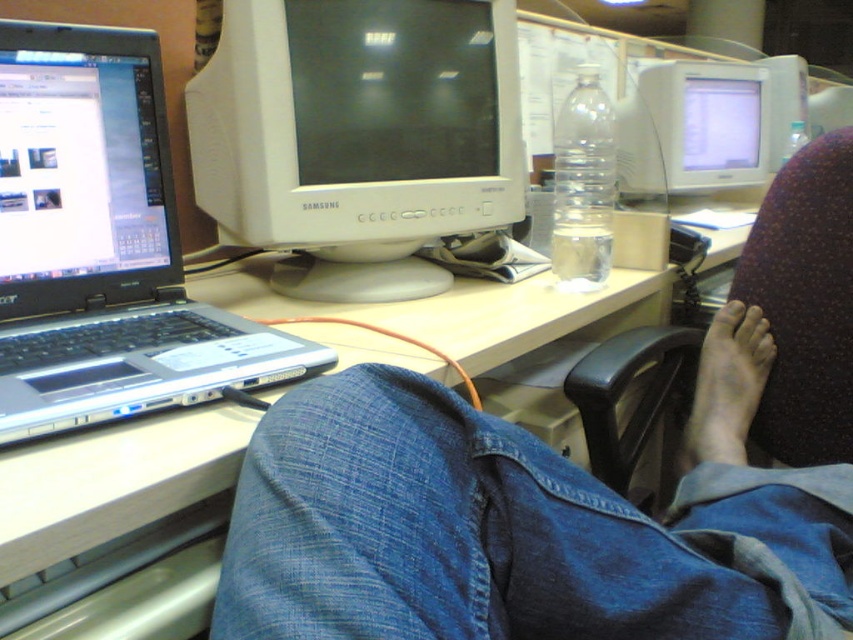
Question: Which point appears closest to the camera in this image?

Choices:
 (A) (627, 333)
 (B) (509, 333)
 (C) (286, 541)
 (D) (746, 362)

Answer: (C)

Question: Is silver metallic laptop at left bigger than dry skin foot at lower right?

Choices:
 (A) yes
 (B) no

Answer: (A)

Question: Observing the image, what is the correct spatial positioning of white glossy computer monitor at upper right in reference to dry skin foot at lower right?

Choices:
 (A) below
 (B) above

Answer: (B)

Question: From the image, what is the correct spatial relationship of silver metallic laptop at left in relation to matte plastic computer desk at center?

Choices:
 (A) below
 (B) above

Answer: (B)

Question: Which of the following is the closest to the observer?

Choices:
 (A) denim pants at lower center
 (B) white plastic monitor at center

Answer: (A)

Question: Estimate the real-world distances between objects in this image. Which object is closer to the silver metallic laptop at left?

Choices:
 (A) dry skin foot at lower right
 (B) white glossy computer monitor at upper right

Answer: (A)